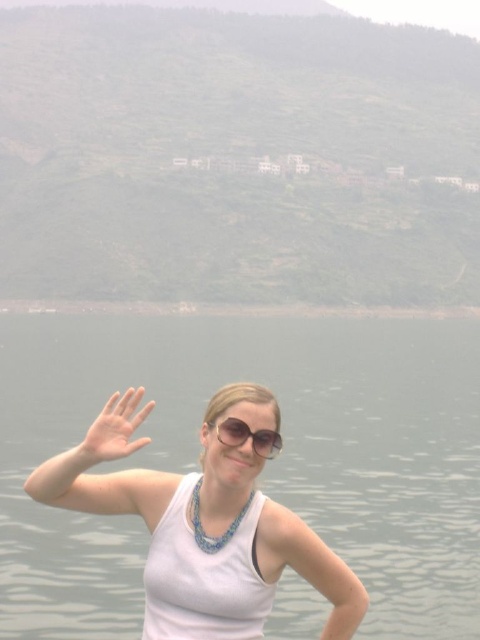
You are a photographer trying to capture the person in the scene. Since the white fabric at center and sunglasses at center are both at the center, which one should you focus on to ensure the subject is in focus?

The white fabric at center has a greater height compared to sunglasses at center, so focusing on the white fabric at center will ensure the subject is in focus as it is larger and more prominent.

Based on the scene description, which object takes up more area in the image? The pale skin flesh at left or the smooth flesh hand at lower left?

The smooth flesh hand at lower left occupies more space than the pale skin flesh at left according to the description.